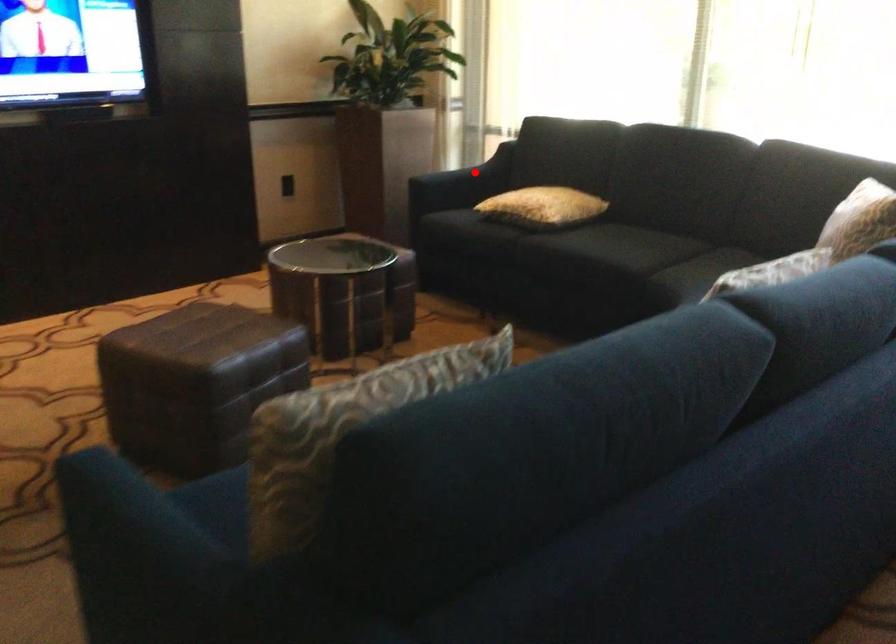
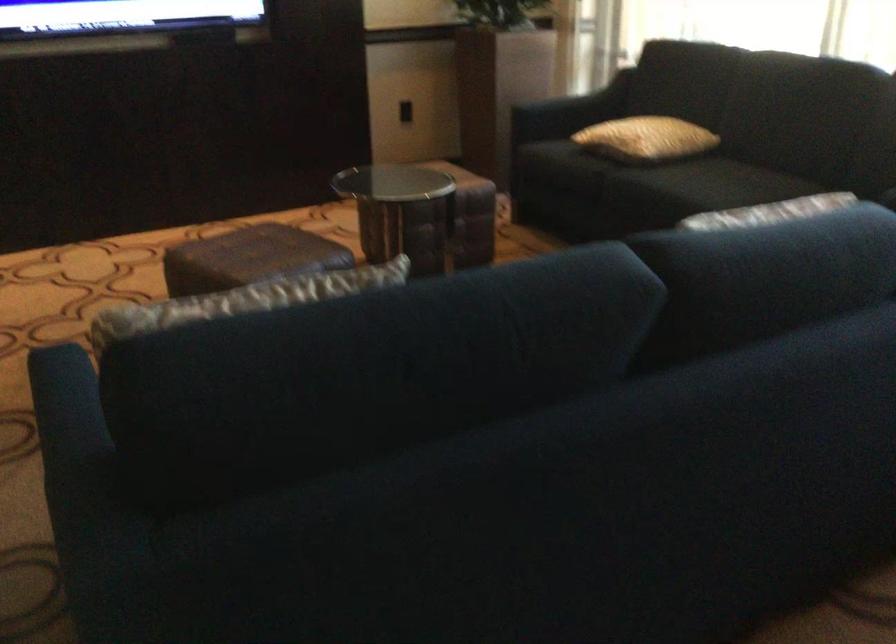
Where in the second image is the point corresponding to the highlighted location from the first image?

(586, 99)